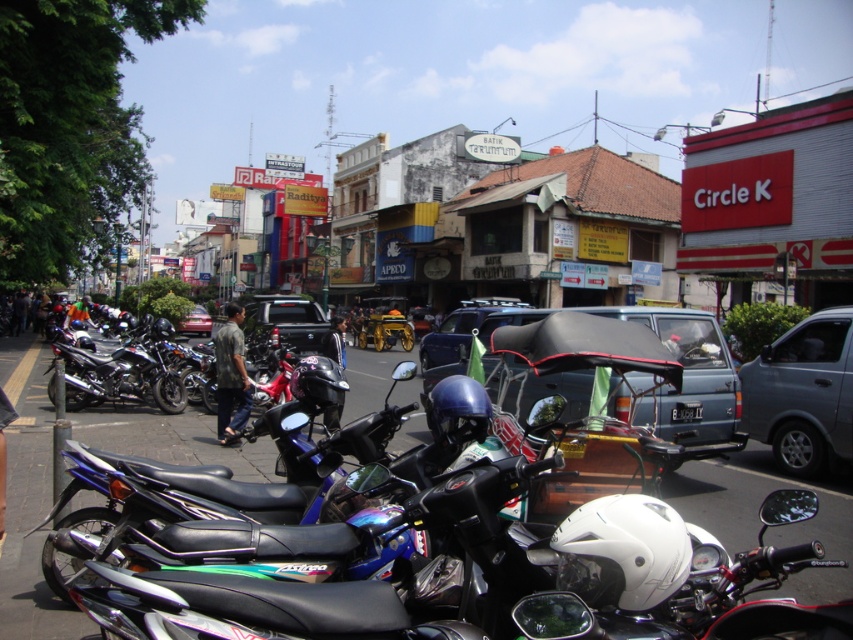
Question: Among these objects, which one is farthest from the camera?

Choices:
 (A) metallic blue pickup truck at center
 (B) blue matte van at center
 (C) light brown shirt at center

Answer: (A)

Question: Which of the following is the closest to the observer?

Choices:
 (A) light brown shirt at center
 (B) shiny black motorcycle at left
 (C) metallic red car at center

Answer: (A)

Question: Can you confirm if blue matte van at center is positioned to the left of shiny black motorcycle at left?

Choices:
 (A) no
 (B) yes

Answer: (A)

Question: Is shiny black motorcycle at left below metallic red car at center?

Choices:
 (A) no
 (B) yes

Answer: (B)

Question: Which is farther from the metallic blue pickup truck at center?

Choices:
 (A) metallic red car at center
 (B) light brown shirt at center

Answer: (A)

Question: Can you confirm if shiny black motorcycle at left is positioned to the left of light brown shirt at center?

Choices:
 (A) no
 (B) yes

Answer: (A)